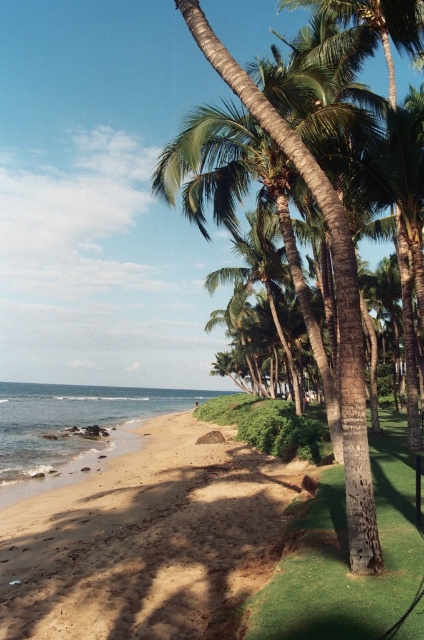
Question: Is green textured palm tree at center in front of clear water at lower left?

Choices:
 (A) yes
 (B) no

Answer: (A)

Question: Which point appears closest to the camera in this image?

Choices:
 (A) (348, 572)
 (B) (45, 524)
 (C) (111, 403)
 (D) (326, 177)

Answer: (A)

Question: Which object appears closest to the camera in this image?

Choices:
 (A) green artificial turf at center
 (B) clear water at lower left
 (C) green textured palm tree at center

Answer: (A)

Question: Does brown sandy beach at lower left appear on the right side of green artificial turf at center?

Choices:
 (A) yes
 (B) no

Answer: (B)

Question: Can you confirm if green artificial turf at center is bigger than green textured palm tree at center?

Choices:
 (A) no
 (B) yes

Answer: (A)

Question: Estimate the real-world distances between objects in this image. Which object is closer to the brown sandy beach at lower left?

Choices:
 (A) green textured palm tree at center
 (B) clear water at lower left

Answer: (A)